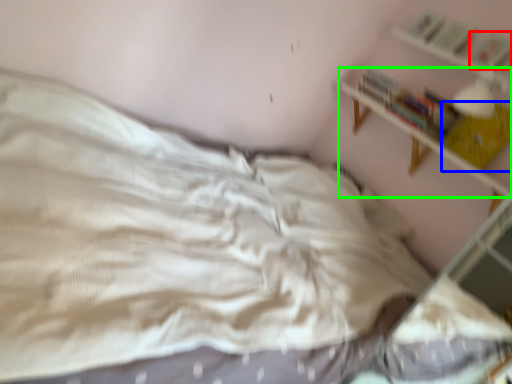
Question: Which object is the farthest from book (highlighted by a red box)? Choose among these: book (highlighted by a blue box) or shelf (highlighted by a green box).

Choices:
 (A) book
 (B) shelf

Answer: (B)